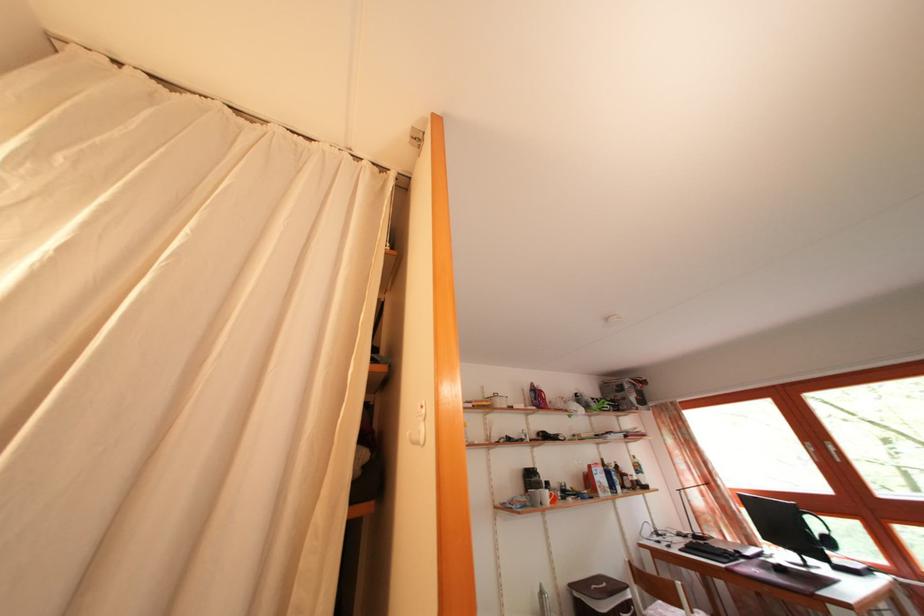
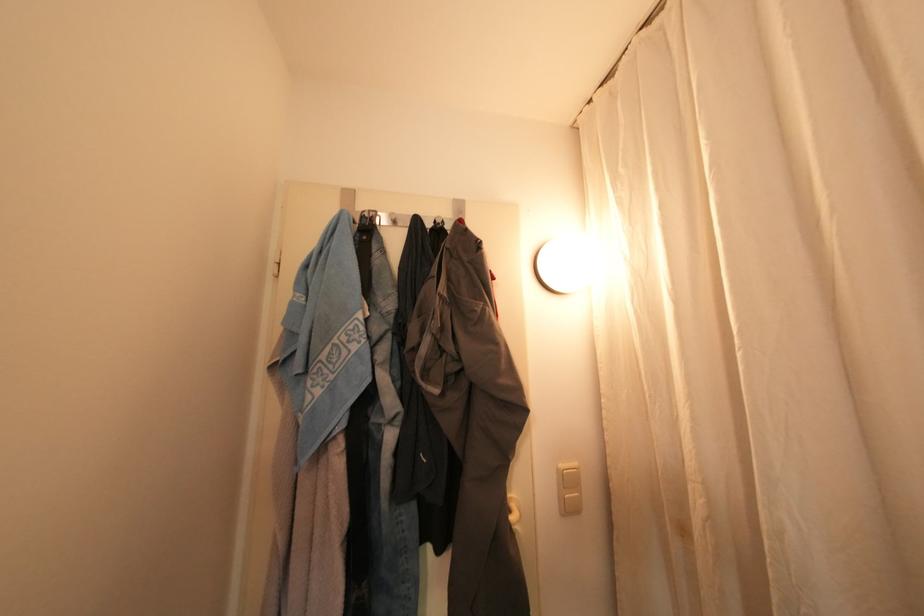
Question: The camera is either moving clockwise (left) or counter-clockwise (right) around the object. The first image is from the beginning of the video and the second image is from the end. Is the camera moving left or right when shooting the video?

Choices:
 (A) Left
 (B) Right

Answer: (B)